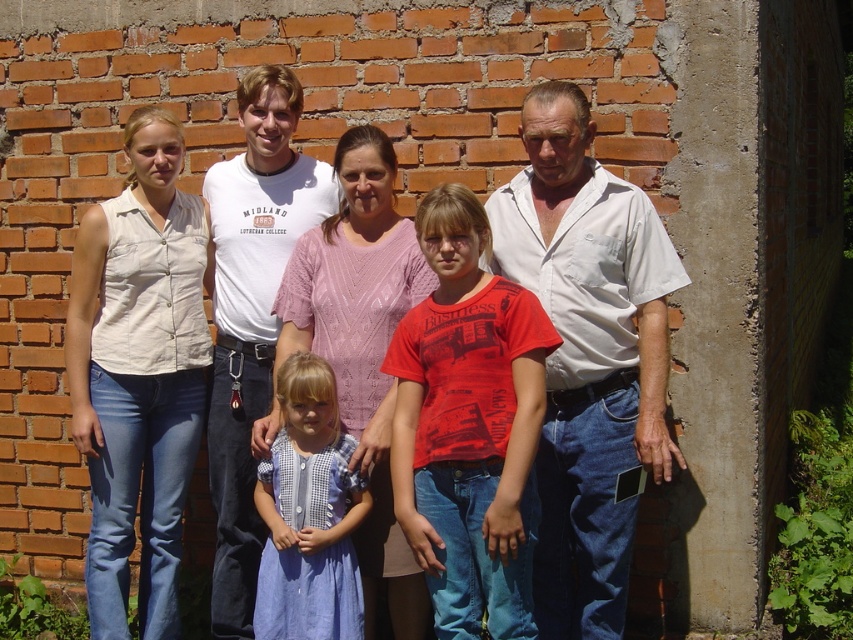
Question: Does matte white shirt at center have a greater width compared to light blue cotton dress at center?

Choices:
 (A) no
 (B) yes

Answer: (B)

Question: Estimate the real-world distances between objects in this image. Which object is farther from the light blue cotton dress at center?

Choices:
 (A) white cotton shirt at right
 (B) matte white shirt at center
 (C) matte red t-shirt at center

Answer: (A)

Question: Which object is positioned farthest from the white cotton t-shirt at center?

Choices:
 (A) matte red t-shirt at center
 (B) blue cotton dress at center
 (C) matte white shirt at center

Answer: (A)

Question: Is white cotton t-shirt at center smaller than light blue cotton dress at center?

Choices:
 (A) yes
 (B) no

Answer: (B)

Question: Among these objects, which one is nearest to the camera?

Choices:
 (A) white cotton t-shirt at center
 (B) white cotton shirt at right

Answer: (B)

Question: Is matte white shirt at center to the right of white cotton t-shirt at center from the viewer's perspective?

Choices:
 (A) no
 (B) yes

Answer: (B)